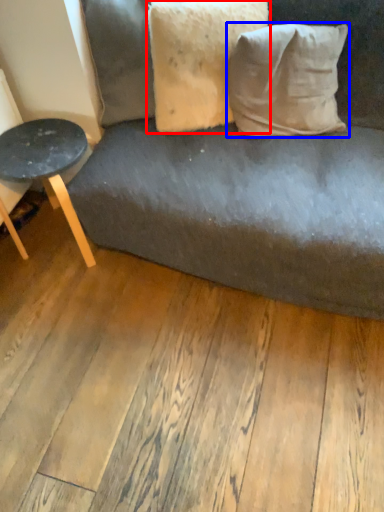
Question: Among these objects, which one is farthest to the camera, pillow (highlighted by a red box) or pillow (highlighted by a blue box)?

Choices:
 (A) pillow
 (B) pillow

Answer: (B)